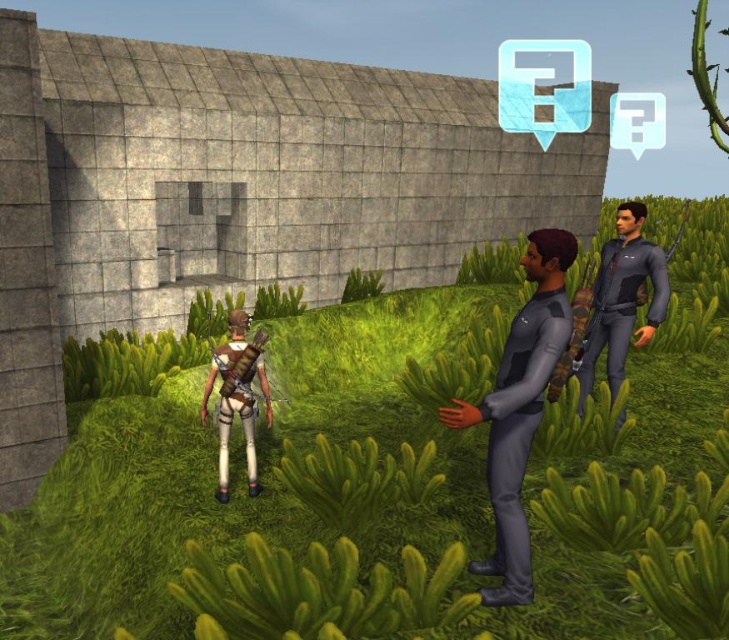
You are a character in the game and need to move from your current position to the green grass at center. Which direction should you move relative to the dark gray matte uniform at center?

You should move to the right of the dark gray matte uniform at center to reach the green grass at center.

You are a game developer working on a new level. You need to place a health pack at the point marked as point (623, 298). Which character should you place it near to ensure it is visible and accessible?

The health pack should be placed near the dark gray fabric shirt at right since it is located at point (623, 298).

You are a character in the game and need to find a spot to rest. The green grass at center is located at coordinates 0.759, 0.509. Can you confirm if this area is suitable for resting?

The green grass at center is located at coordinates (370, 484), which is a suitable spot for resting as it is the central area with lush greenery.